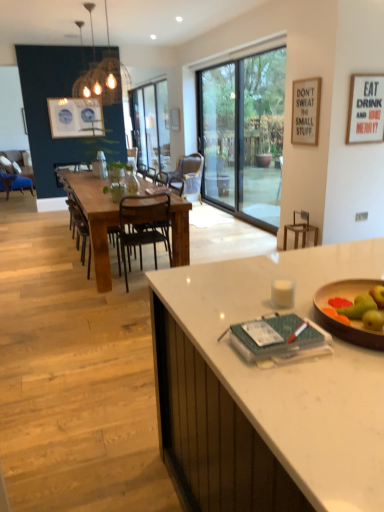
Question: Is white matte picture frame at upper right, acting as the second picture frame starting from the bottom, directly adjacent to brown wooden chair at center, the 2th chair viewed from the front?

Choices:
 (A) no
 (B) yes

Answer: (A)

Question: Is there a large distance between white matte picture frame at upper right, acting as the second picture frame starting from the bottom, and brown wooden chair at center, the fourth chair when ordered from right to left?

Choices:
 (A) yes
 (B) no

Answer: (A)

Question: Is white matte picture frame at upper right, acting as the second picture frame starting from the bottom, to the right of brown wooden chair at center, which is the 4th chair from back to front, from the viewer's perspective?

Choices:
 (A) yes
 (B) no

Answer: (A)

Question: From the image's perspective, would you say white matte picture frame at upper right, the second picture frame positioned from the left, is shown under brown wooden chair at center, the 2th chair viewed from the front?

Choices:
 (A) no
 (B) yes

Answer: (A)

Question: Is white matte picture frame at upper right, the second picture frame positioned from the left, surrounding brown wooden chair at center, the fourth chair when ordered from right to left?

Choices:
 (A) no
 (B) yes

Answer: (A)

Question: Does point (x=11, y=176) appear closer or farther from the camera than point (x=67, y=133)?

Choices:
 (A) farther
 (B) closer

Answer: (A)

Question: From their relative heights in the image, would you say matte blue chair at left, acting as the first chair starting from the back, is taller or shorter than blue ceramic plates at upper left?

Choices:
 (A) tall
 (B) short

Answer: (A)

Question: Would you say matte blue chair at left, acting as the first chair starting from the back, is inside or outside blue ceramic plates at upper left?

Choices:
 (A) outside
 (B) inside

Answer: (A)

Question: In terms of size, does matte blue chair at left, the fifth chair when ordered from front to back, appear bigger or smaller than blue ceramic plates at upper left?

Choices:
 (A) big
 (B) small

Answer: (A)

Question: In terms of size, does woven wood pendant light at upper center appear bigger or smaller than green matte apple at right?

Choices:
 (A) big
 (B) small

Answer: (A)

Question: From the image's perspective, is woven wood pendant light at upper center located above or below green matte apple at right?

Choices:
 (A) below
 (B) above

Answer: (B)

Question: Considering the relative positions of woven wood pendant light at upper center and green matte apple at right in the image provided, is woven wood pendant light at upper center to the left or to the right of green matte apple at right?

Choices:
 (A) left
 (B) right

Answer: (A)

Question: From a real-world perspective, relative to green matte apple at right, is woven wood pendant light at upper center vertically above or below?

Choices:
 (A) above
 (B) below

Answer: (A)

Question: From the image's perspective, relative to green matte apple at right, is brown wooden bar stool at center above or below?

Choices:
 (A) above
 (B) below

Answer: (A)

Question: Is brown wooden bar stool at center wider or thinner than green matte apple at right?

Choices:
 (A) thin
 (B) wide

Answer: (B)